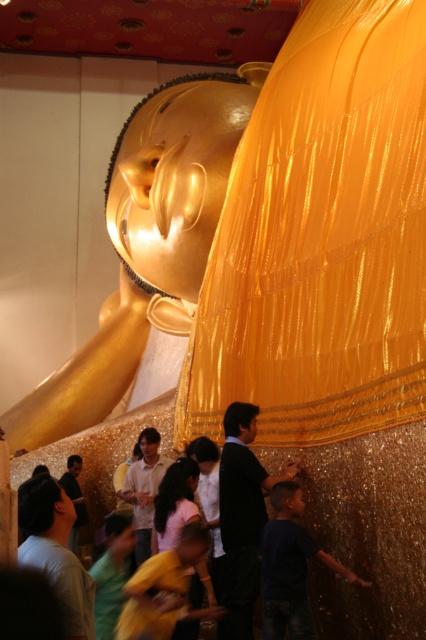
Question: Does gold shiny statue at center appear on the right side of black matte monk at center?

Choices:
 (A) no
 (B) yes

Answer: (A)

Question: Estimate the real-world distances between objects in this image. Which object is farther from the gold shiny statue at center?

Choices:
 (A) black matte monk at center
 (B) matte gold monk at center

Answer: (A)

Question: Which point is closer to the camera taking this photo?

Choices:
 (A) (123, 488)
 (B) (160, 125)
 (C) (224, 444)

Answer: (C)

Question: Considering the relative positions of gold shiny statue at center and black matte monk at center in the image provided, where is gold shiny statue at center located with respect to black matte monk at center?

Choices:
 (A) below
 (B) above

Answer: (B)

Question: Is black matte monk at center closer to the viewer compared to matte gold monk at center?

Choices:
 (A) yes
 (B) no

Answer: (A)

Question: Estimate the real-world distances between objects in this image. Which object is closer to the black matte monk at center?

Choices:
 (A) matte gold monk at center
 (B) gold shiny statue at center

Answer: (A)